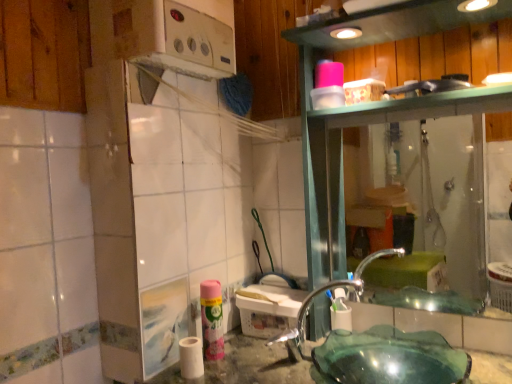
Question: Should I look upward or downward to see white matte toilet paper at lower center?

Choices:
 (A) up
 (B) down

Answer: (B)

Question: Can you confirm if green glass sink at lower center is bigger than pink matte shaving cream at lower center?

Choices:
 (A) yes
 (B) no

Answer: (A)

Question: Considering the relative sizes of green glass sink at lower center and pink matte shaving cream at lower center in the image provided, is green glass sink at lower center smaller than pink matte shaving cream at lower center?

Choices:
 (A) no
 (B) yes

Answer: (A)

Question: Considering the relative sizes of green glass sink at lower center and pink matte shaving cream at lower center in the image provided, is green glass sink at lower center thinner than pink matte shaving cream at lower center?

Choices:
 (A) no
 (B) yes

Answer: (A)

Question: Is green glass sink at lower center placed right next to pink matte shaving cream at lower center?

Choices:
 (A) no
 (B) yes

Answer: (A)

Question: Is green glass sink at lower center positioned behind pink matte shaving cream at lower center?

Choices:
 (A) no
 (B) yes

Answer: (A)

Question: Could you tell me if green glass sink at lower center is turned towards pink matte shaving cream at lower center?

Choices:
 (A) no
 (B) yes

Answer: (A)

Question: Can you confirm if transparent glass shower at right is wider than clear glass faucet at lower center?

Choices:
 (A) no
 (B) yes

Answer: (A)

Question: Is transparent glass shower at right turned away from clear glass faucet at lower center?

Choices:
 (A) no
 (B) yes

Answer: (A)

Question: Considering the relative sizes of transparent glass shower at right and clear glass faucet at lower center in the image provided, is transparent glass shower at right smaller than clear glass faucet at lower center?

Choices:
 (A) no
 (B) yes

Answer: (A)

Question: Is transparent glass shower at right at the left side of clear glass faucet at lower center?

Choices:
 (A) yes
 (B) no

Answer: (B)

Question: Is transparent glass shower at right aimed at clear glass faucet at lower center?

Choices:
 (A) yes
 (B) no

Answer: (A)

Question: From a real-world perspective, is transparent glass shower at right under clear glass faucet at lower center?

Choices:
 (A) yes
 (B) no

Answer: (B)

Question: Does transparent glass shower at right have a lesser width compared to white matte toilet paper at lower center?

Choices:
 (A) yes
 (B) no

Answer: (A)